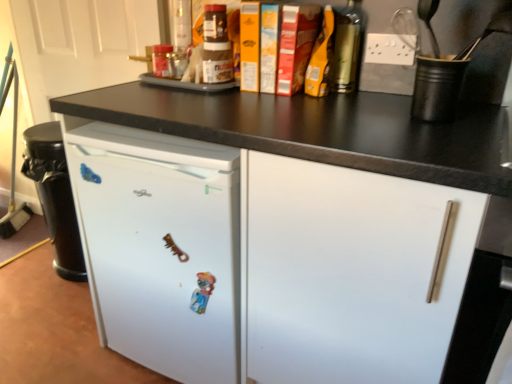
Locate an element on the screen. This screenshot has width=512, height=384. vacant region in front of black matte cup at upper right is located at coordinates (441, 137).